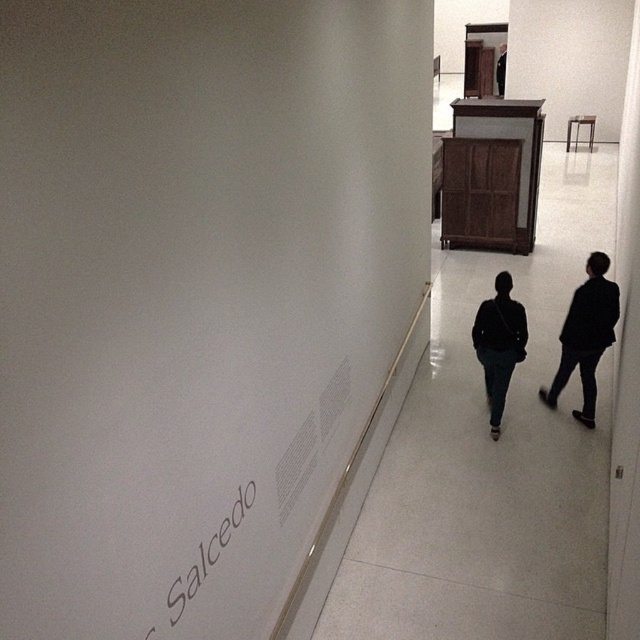
Question: Among these points, which one is farthest from the camera?

Choices:
 (A) (545, 390)
 (B) (600, 332)
 (C) (522, 342)

Answer: (A)

Question: Does dark fabric jacket at center have a lesser width compared to dark brown leather jacket at upper center?

Choices:
 (A) no
 (B) yes

Answer: (A)

Question: Can you confirm if dark fabric jacket at center is smaller than gray paper salcedo at lower left?

Choices:
 (A) no
 (B) yes

Answer: (A)

Question: Is dark fabric jacket at center positioned in front of dark brown leather jacket at upper center?

Choices:
 (A) no
 (B) yes

Answer: (B)

Question: Which point is farther to the camera?

Choices:
 (A) (228, 518)
 (B) (582, 282)
 (C) (572, 323)

Answer: (B)

Question: Which point is closer to the camera taking this photo?

Choices:
 (A) (600, 332)
 (B) (595, 346)
 (C) (218, 556)

Answer: (C)